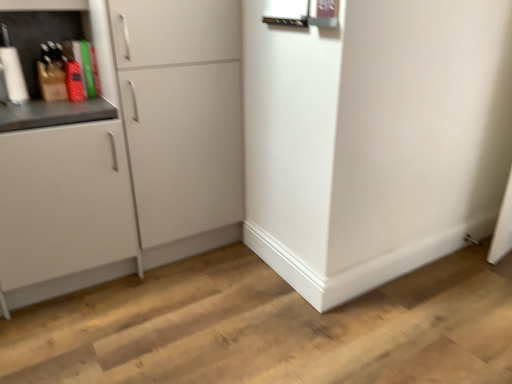
What do you see at coordinates (139, 142) in the screenshot? This screenshot has height=384, width=512. I see `white matte cabinet at left, which is the 2th cabinetry in left-to-right order` at bounding box center [139, 142].

Locate an element on the screen. white matte cabinet at left, which is the first cabinetry from right to left is located at coordinates (139, 142).

Measure the distance between white matte cabinet at left, which is the 2th cabinetry in left-to-right order, and camera.

They are 1.66 meters apart.

In order to face white matte cabinet at left, which is the first cabinetry from right to left, should I rotate leftwards or rightwards?

To align with it, rotate left about 11.547°.

Locate an element on the screen. The width and height of the screenshot is (512, 384). white matte cabinet at left, the 1th cabinetry from the left is located at coordinates (64, 202).

What do you see at coordinates (64, 202) in the screenshot?
I see `white matte cabinet at left, the 1th cabinetry from the left` at bounding box center [64, 202].

How much space does white matte cabinet at left, placed as the second cabinetry when sorted from right to left, occupy vertically?

The height of white matte cabinet at left, placed as the second cabinetry when sorted from right to left, is 35.99 inches.

I want to click on white matte cabinet at left, which is the first cabinetry from right to left, so click(x=139, y=142).

Does white matte cabinet at left, which is the 2th cabinetry in left-to-right order, appear on the right side of white matte cabinet at left, placed as the second cabinetry when sorted from right to left?

Indeed, white matte cabinet at left, which is the 2th cabinetry in left-to-right order, is positioned on the right side of white matte cabinet at left, placed as the second cabinetry when sorted from right to left.

Which is behind, white matte cabinet at left, which is the first cabinetry from right to left, or white matte cabinet at left, the 1th cabinetry from the left?

Positioned behind is white matte cabinet at left, which is the first cabinetry from right to left.

Is point (168, 125) closer or farther from the camera than point (104, 191)?

Point (168, 125) is farther from the camera than point (104, 191).

From the image's perspective, is white matte cabinet at left, which is the first cabinetry from right to left, above white matte cabinet at left, the 1th cabinetry from the left?

Yes.

From a real-world perspective, between white matte cabinet at left, which is the first cabinetry from right to left, and white matte cabinet at left, the 1th cabinetry from the left, who is vertically higher?

white matte cabinet at left, which is the first cabinetry from right to left, is physically above.

Considering the sizes of white matte cabinet at left, which is the 2th cabinetry in left-to-right order, and white matte cabinet at left, placed as the second cabinetry when sorted from right to left, in the image, is white matte cabinet at left, which is the 2th cabinetry in left-to-right order, wider or thinner than white matte cabinet at left, placed as the second cabinetry when sorted from right to left,?

Considering their sizes, white matte cabinet at left, which is the 2th cabinetry in left-to-right order, looks slimmer than white matte cabinet at left, placed as the second cabinetry when sorted from right to left.

Between white matte cabinet at left, which is the 2th cabinetry in left-to-right order, and white matte cabinet at left, placed as the second cabinetry when sorted from right to left, which one has more height?

Standing taller between the two is white matte cabinet at left, which is the 2th cabinetry in left-to-right order.

Does white matte cabinet at left, which is the 2th cabinetry in left-to-right order, have a larger size compared to white matte cabinet at left, placed as the second cabinetry when sorted from right to left?

Correct, white matte cabinet at left, which is the 2th cabinetry in left-to-right order, is larger in size than white matte cabinet at left, placed as the second cabinetry when sorted from right to left.

Is white matte cabinet at left, placed as the second cabinetry when sorted from right to left, completely or partially inside white matte cabinet at left, which is the 2th cabinetry in left-to-right order?

That's incorrect, white matte cabinet at left, placed as the second cabinetry when sorted from right to left, is not inside white matte cabinet at left, which is the 2th cabinetry in left-to-right order.

Is white matte cabinet at left, which is the 2th cabinetry in left-to-right order, in contact with white matte cabinet at left, the 1th cabinetry from the left?

white matte cabinet at left, which is the 2th cabinetry in left-to-right order, and white matte cabinet at left, the 1th cabinetry from the left, are clearly separated.

Is white matte cabinet at left, placed as the second cabinetry when sorted from right to left, at the back of white matte cabinet at left, which is the 2th cabinetry in left-to-right order?

No, white matte cabinet at left, placed as the second cabinetry when sorted from right to left, is not at the back of white matte cabinet at left, which is the 2th cabinetry in left-to-right order.

How different are the orientations of white matte cabinet at left, which is the 2th cabinetry in left-to-right order, and white matte cabinet at left, the 1th cabinetry from the left, in degrees?

2.32 degrees.

Find the location of a particular element. This screenshot has height=384, width=512. cabinetry in front of the white matte cabinet at left, which is the first cabinetry from right to left is located at coordinates (64, 202).

From the picture: Is white matte cabinet at left, placed as the second cabinetry when sorted from right to left, at the left side of white matte cabinet at left, which is the 2th cabinetry in left-to-right order?

Indeed, white matte cabinet at left, placed as the second cabinetry when sorted from right to left, is positioned on the left side of white matte cabinet at left, which is the 2th cabinetry in left-to-right order.

Which is in front, white matte cabinet at left, the 1th cabinetry from the left, or white matte cabinet at left, which is the 2th cabinetry in left-to-right order?

Positioned in front is white matte cabinet at left, the 1th cabinetry from the left.

Which is further, (x=12, y=198) or (x=10, y=236)?

Positioned behind is point (x=10, y=236).

From the image's perspective, who appears lower, white matte cabinet at left, the 1th cabinetry from the left, or white matte cabinet at left, which is the first cabinetry from right to left?

white matte cabinet at left, the 1th cabinetry from the left, is shown below in the image.

From a real-world perspective, is white matte cabinet at left, placed as the second cabinetry when sorted from right to left, on top of white matte cabinet at left, which is the 2th cabinetry in left-to-right order?

No.

Which object is thinner, white matte cabinet at left, the 1th cabinetry from the left, or white matte cabinet at left, which is the first cabinetry from right to left?

Thinner between the two is white matte cabinet at left, which is the first cabinetry from right to left.

From their relative heights in the image, would you say white matte cabinet at left, the 1th cabinetry from the left, is taller or shorter than white matte cabinet at left, which is the first cabinetry from right to left?

In the image, white matte cabinet at left, the 1th cabinetry from the left, appears to be shorter than white matte cabinet at left, which is the first cabinetry from right to left.

Is white matte cabinet at left, placed as the second cabinetry when sorted from right to left, bigger than white matte cabinet at left, which is the 2th cabinetry in left-to-right order?

No, white matte cabinet at left, placed as the second cabinetry when sorted from right to left, is not bigger than white matte cabinet at left, which is the 2th cabinetry in left-to-right order.

Is white matte cabinet at left, placed as the second cabinetry when sorted from right to left, located outside white matte cabinet at left, which is the first cabinetry from right to left?

Yes, white matte cabinet at left, placed as the second cabinetry when sorted from right to left, is located beyond the bounds of white matte cabinet at left, which is the first cabinetry from right to left.

Is white matte cabinet at left, placed as the second cabinetry when sorted from right to left, not near white matte cabinet at left, which is the 2th cabinetry in left-to-right order?

No, white matte cabinet at left, placed as the second cabinetry when sorted from right to left, is in close proximity to white matte cabinet at left, which is the 2th cabinetry in left-to-right order.

Could you tell me if white matte cabinet at left, placed as the second cabinetry when sorted from right to left, is turned towards white matte cabinet at left, which is the 2th cabinetry in left-to-right order?

No, white matte cabinet at left, placed as the second cabinetry when sorted from right to left, is not oriented towards white matte cabinet at left, which is the 2th cabinetry in left-to-right order.

The image size is (512, 384). What are the coordinates of `cabinetry to the left of white matte cabinet at left, which is the first cabinetry from right to left` in the screenshot? It's located at (64, 202).

Where is `cabinetry below the white matte cabinet at left, which is the 2th cabinetry in left-to-right order (from a real-world perspective)`? This screenshot has height=384, width=512. cabinetry below the white matte cabinet at left, which is the 2th cabinetry in left-to-right order (from a real-world perspective) is located at coordinates (64, 202).

The width and height of the screenshot is (512, 384). I want to click on cabinetry behind the white matte cabinet at left, placed as the second cabinetry when sorted from right to left, so click(139, 142).